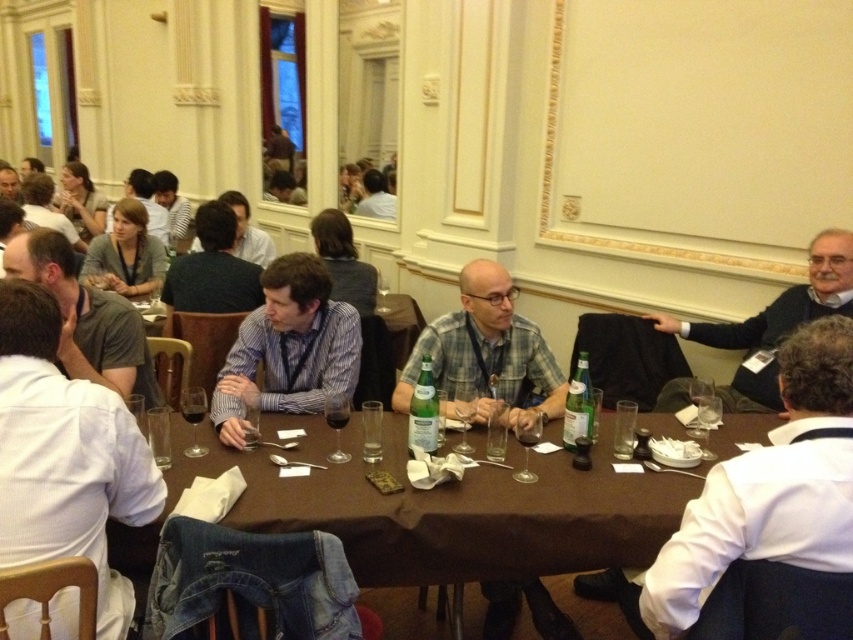
Question: Is dark gray sweater at right wider than matte white shirt at upper left?

Choices:
 (A) no
 (B) yes

Answer: (B)

Question: Estimate the real-world distances between objects in this image. Which object is closer to the white shirt at right?

Choices:
 (A) matte white shirt at upper left
 (B) gray shirt at left
 (C) dark brown hair at center

Answer: (B)

Question: Based on their relative distances, which object is farther from the brown fabric table at center?

Choices:
 (A) gray shirt at left
 (B) matte blue shirt at center

Answer: (B)

Question: Considering the relative positions of plaid fabric shirt at center and blue striped shirt at center in the image provided, where is plaid fabric shirt at center located with respect to blue striped shirt at center?

Choices:
 (A) left
 (B) right

Answer: (B)

Question: Which of the following is the farthest from the observer?

Choices:
 (A) (227, 202)
 (B) (202, 280)

Answer: (A)

Question: Can you confirm if brown fabric table at center is smaller than gray shirt at left?

Choices:
 (A) no
 (B) yes

Answer: (A)